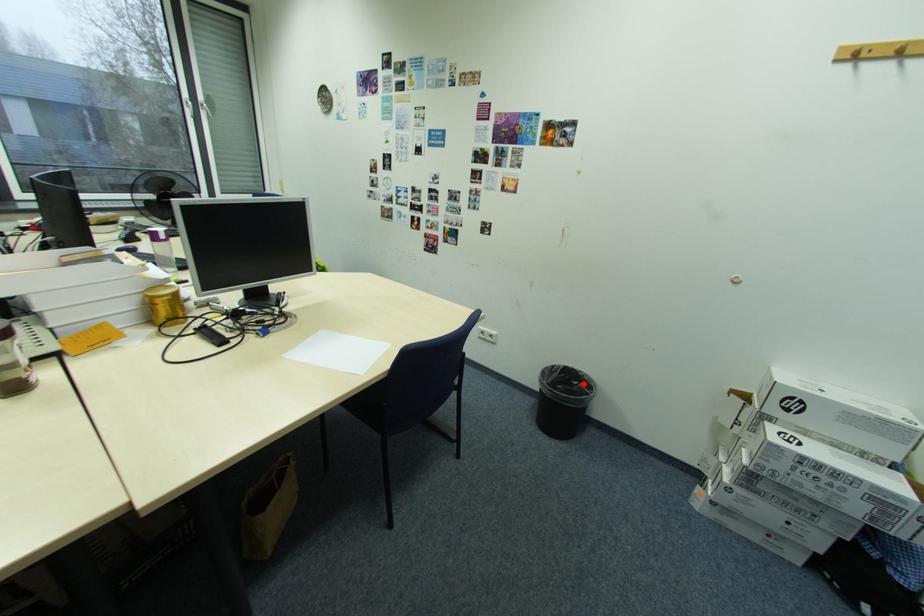
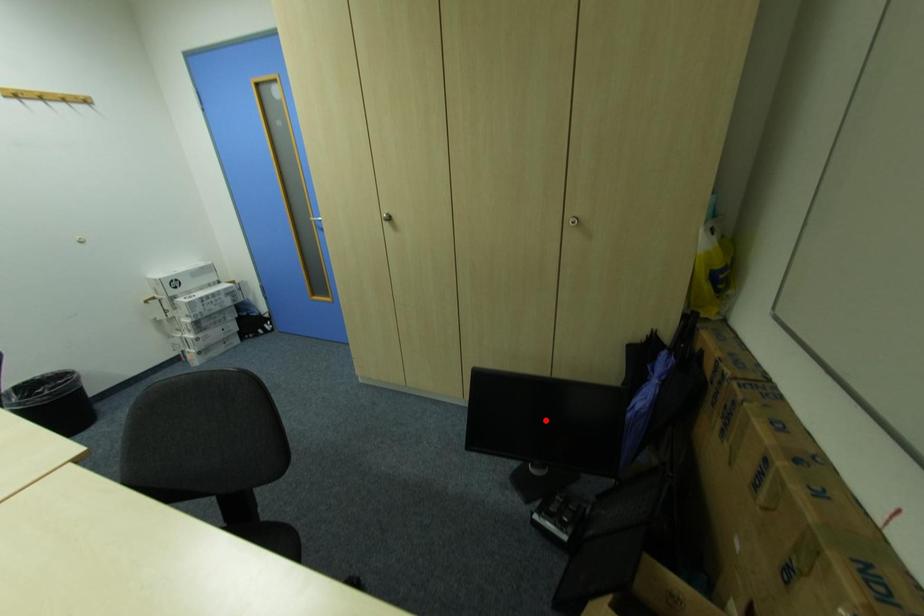
I am providing you with two images of the same scene from different viewpoints. A red point is marked on the first image and another point is marked on the second image. Do the highlighted points in image1 and image2 indicate the same real-world spot?

No